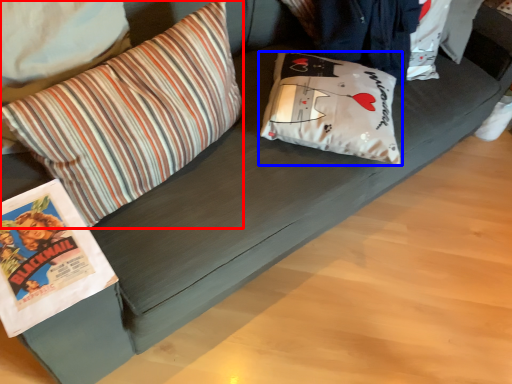
Question: Which object appears closest to the camera in this image, pillow (highlighted by a red box) or pillow (highlighted by a blue box)?

Choices:
 (A) pillow
 (B) pillow

Answer: (A)